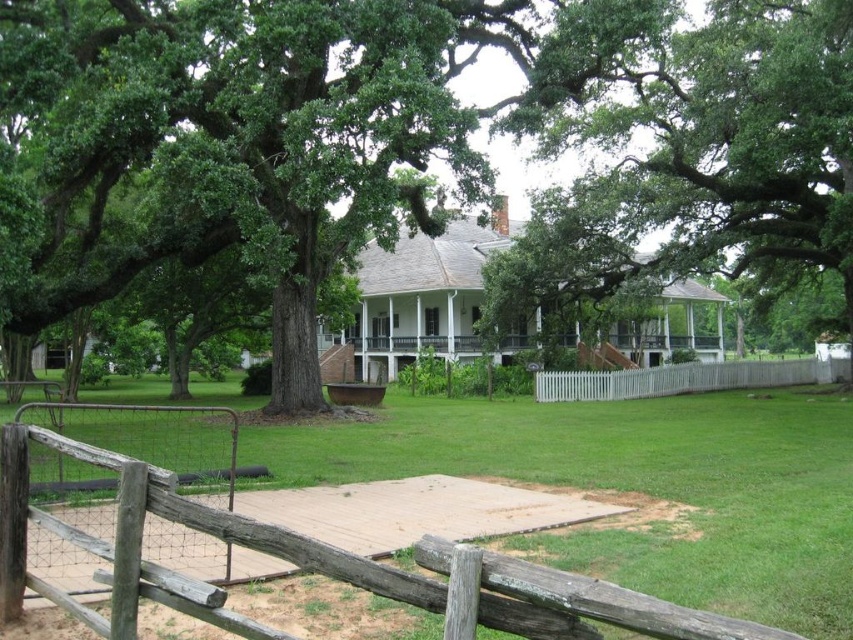
Question: Which is farther from the green leafy tree at upper center?

Choices:
 (A) brown wooden fence at lower center
 (B) green leafy tree at center

Answer: (A)

Question: Is green leafy tree at center to the right of white picket fence at center from the viewer's perspective?

Choices:
 (A) yes
 (B) no

Answer: (B)

Question: Based on their relative distances, which object is nearer to the white picket fence at center?

Choices:
 (A) green leafy tree at upper center
 (B) white wooden porch at center
 (C) brown wooden fence at lower center
 (D) green leafy tree at center

Answer: (A)

Question: Does brown wooden fence at lower center appear on the left side of white picket fence at center?

Choices:
 (A) no
 (B) yes

Answer: (B)

Question: Among these points, which one is nearest to the camera?

Choices:
 (A) (33, 77)
 (B) (432, 342)
 (C) (572, 387)
 (D) (585, 577)

Answer: (D)

Question: Does green leafy tree at center appear over white wooden porch at center?

Choices:
 (A) no
 (B) yes

Answer: (B)